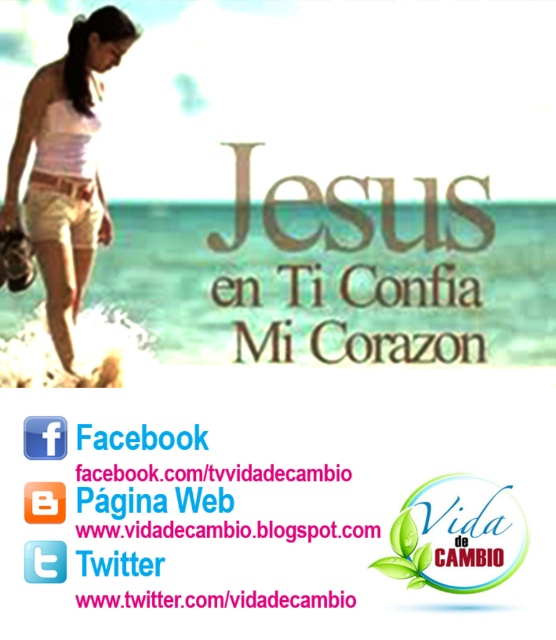
Question: Can you confirm if white cotton shorts at left is positioned above white matte tank top at upper left?

Choices:
 (A) yes
 (B) no

Answer: (B)

Question: Is white cotton shorts at left to the left of white matte tank top at upper left from the viewer's perspective?

Choices:
 (A) yes
 (B) no

Answer: (A)

Question: Which of the following is the closest to the observer?

Choices:
 (A) (61, 266)
 (B) (52, 154)

Answer: (B)

Question: Is white cotton shorts at left further to the viewer compared to white matte tank top at upper left?

Choices:
 (A) no
 (B) yes

Answer: (A)